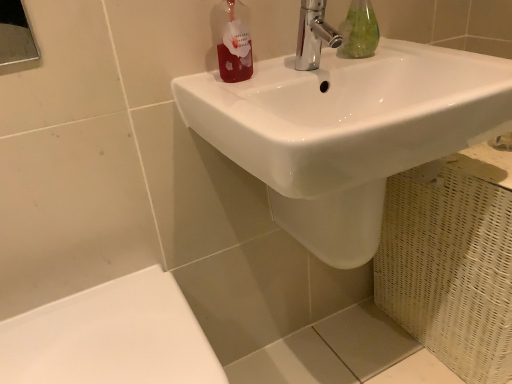
Question: Is white glossy sink at upper center at the left side of chrome/metallic faucet at upper center?

Choices:
 (A) yes
 (B) no

Answer: (B)

Question: From the image's perspective, is white glossy sink at upper center above chrome/metallic faucet at upper center?

Choices:
 (A) yes
 (B) no

Answer: (B)

Question: From a real-world perspective, is white glossy sink at upper center located beneath chrome/metallic faucet at upper center?

Choices:
 (A) no
 (B) yes

Answer: (B)

Question: Is white glossy sink at upper center shorter than chrome/metallic faucet at upper center?

Choices:
 (A) yes
 (B) no

Answer: (B)

Question: Considering the relative sizes of white glossy sink at upper center and chrome/metallic faucet at upper center in the image provided, is white glossy sink at upper center thinner than chrome/metallic faucet at upper center?

Choices:
 (A) no
 (B) yes

Answer: (A)

Question: Considering the relative sizes of white glossy sink at upper center and chrome/metallic faucet at upper center in the image provided, is white glossy sink at upper center taller than chrome/metallic faucet at upper center?

Choices:
 (A) yes
 (B) no

Answer: (A)

Question: Is green glass bottle at upper center not close to white glossy porcelain at lower left?

Choices:
 (A) yes
 (B) no

Answer: (B)

Question: Does green glass bottle at upper center have a greater width compared to white glossy porcelain at lower left?

Choices:
 (A) yes
 (B) no

Answer: (B)

Question: Is green glass bottle at upper center thinner than white glossy porcelain at lower left?

Choices:
 (A) yes
 (B) no

Answer: (A)

Question: Is green glass bottle at upper center positioned behind white glossy porcelain at lower left?

Choices:
 (A) yes
 (B) no

Answer: (A)

Question: Can you confirm if green glass bottle at upper center is taller than white glossy porcelain at lower left?

Choices:
 (A) yes
 (B) no

Answer: (B)

Question: Is green glass bottle at upper center in contact with white glossy porcelain at lower left?

Choices:
 (A) yes
 (B) no

Answer: (B)

Question: Is white glossy porcelain at lower left inside white glossy sink at upper center?

Choices:
 (A) no
 (B) yes

Answer: (A)